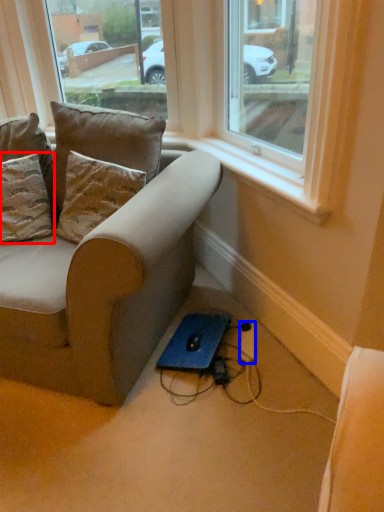
Question: Among these objects, which one is farthest to the camera, pillow (highlighted by a red box) or extension cord (highlighted by a blue box)?

Choices:
 (A) pillow
 (B) extension cord

Answer: (B)